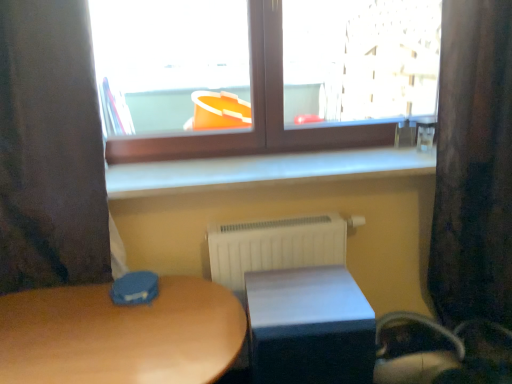
Where is `vacant area on top of matte wooden table at center, arranged as the 1th table when viewed from the left (from a real-world perspective)`? This screenshot has height=384, width=512. vacant area on top of matte wooden table at center, arranged as the 1th table when viewed from the left (from a real-world perspective) is located at coordinates (115, 331).